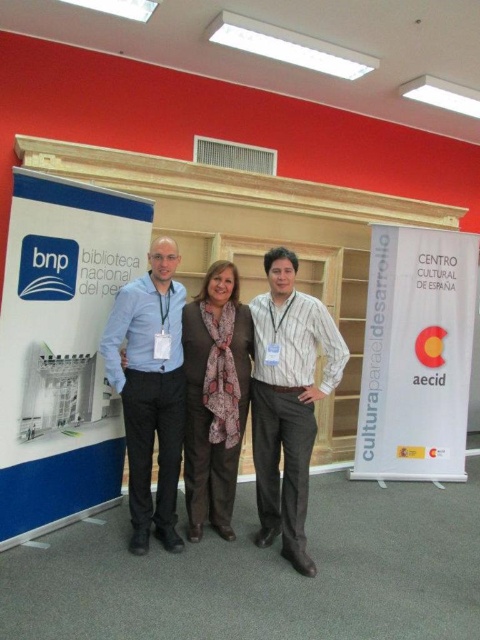
Question: Which object is farther from the camera taking this photo?

Choices:
 (A) brown textured scarf at center
 (B) striped cotton shirt at center

Answer: (A)

Question: Where is white paper at center located in relation to striped cotton shirt at center in the image?

Choices:
 (A) left
 (B) right

Answer: (B)

Question: Which point is closer to the camera?

Choices:
 (A) white paper at center
 (B) striped cotton shirt at center
 (C) brown textured scarf at center
 (D) matte blue shirt at center

Answer: (B)

Question: Can you confirm if white paper at center is positioned to the left of matte blue shirt at center?

Choices:
 (A) no
 (B) yes

Answer: (A)

Question: Estimate the real-world distances between objects in this image. Which object is closer to the striped cotton shirt at center?

Choices:
 (A) white paper at center
 (B) matte blue shirt at center
 (C) brown textured scarf at center

Answer: (C)

Question: Where is white paper at center located in relation to matte blue shirt at center in the image?

Choices:
 (A) right
 (B) left

Answer: (A)